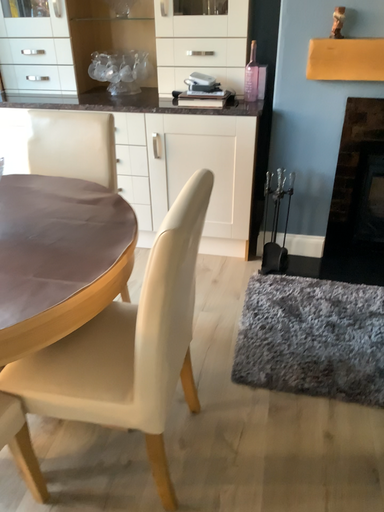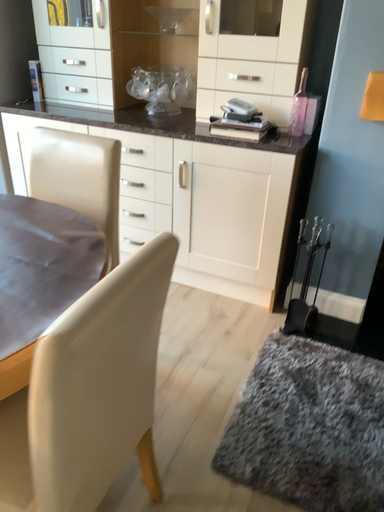
Question: Which way did the camera rotate in the video?

Choices:
 (A) rotated left
 (B) rotated right

Answer: (A)